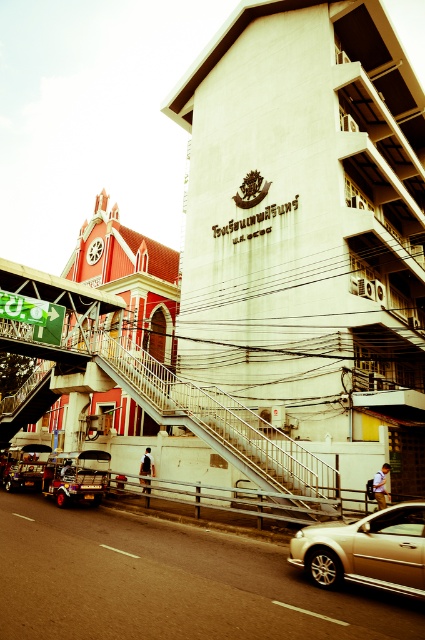
Question: Among these points, which one is farthest from the camera?

Choices:
 (A) (45, 480)
 (B) (325, 540)
 (C) (36, 461)

Answer: (C)

Question: Can you confirm if metallic gold tuk-tuk at lower left is thinner than shiny black tuk-tuk at lower left?

Choices:
 (A) no
 (B) yes

Answer: (A)

Question: Which point appears farthest from the camera in this image?

Choices:
 (A) (31, 472)
 (B) (351, 573)

Answer: (A)

Question: Which point is farther from the camera taking this photo?

Choices:
 (A) (6, 490)
 (B) (53, 477)

Answer: (A)

Question: Does metallic gold tuk-tuk at lower left have a smaller size compared to shiny black tuk-tuk at lower left?

Choices:
 (A) no
 (B) yes

Answer: (A)

Question: Where is gold metallic car at lower right located in relation to shiny black tuk-tuk at lower left in the image?

Choices:
 (A) below
 (B) above

Answer: (B)